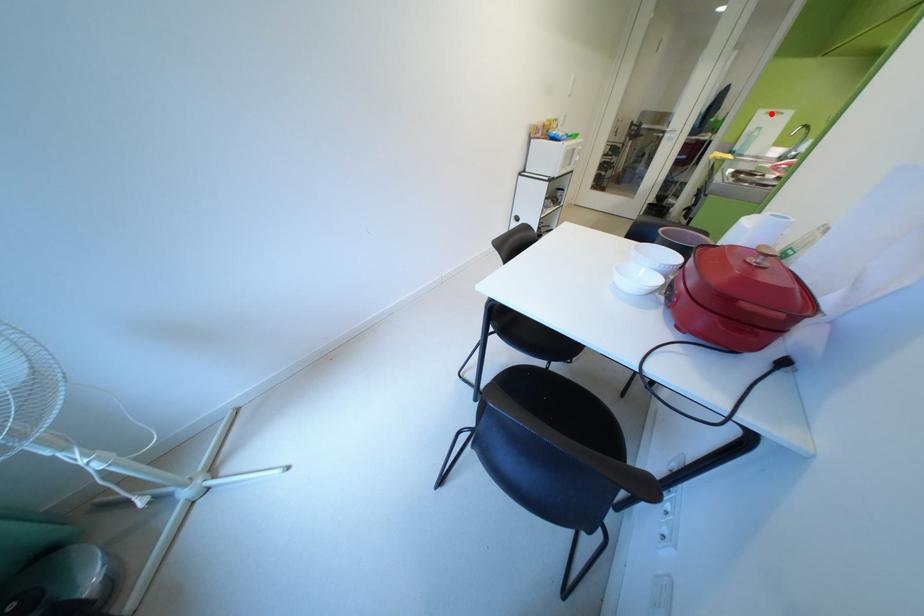
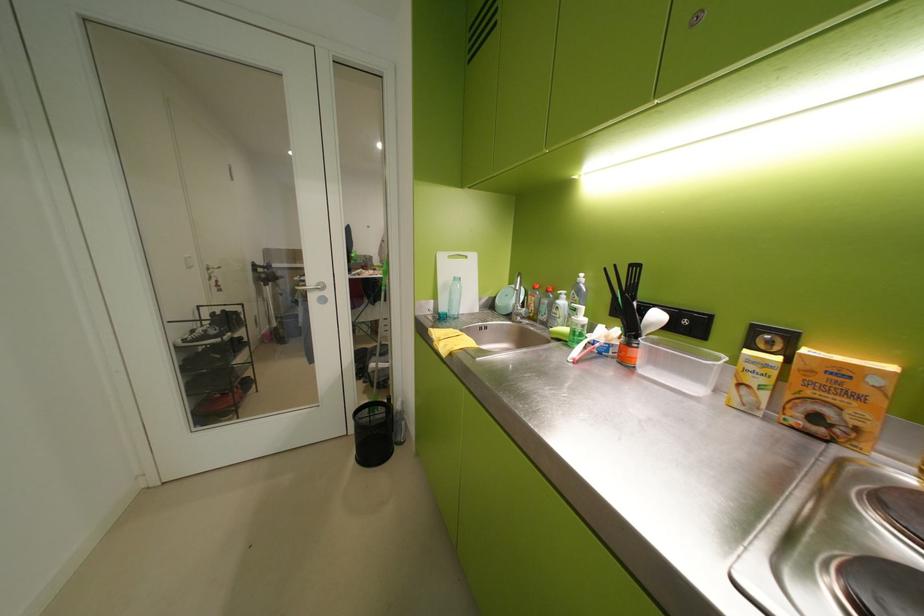
Find the pixel in the second image that matches the highlighted location in the first image.

(453, 259)